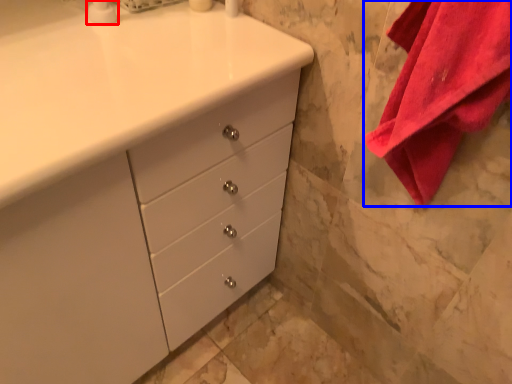
Question: Which point is further to the camera, soap dispenser (highlighted by a red box) or bath towel (highlighted by a blue box)?

Choices:
 (A) soap dispenser
 (B) bath towel

Answer: (A)